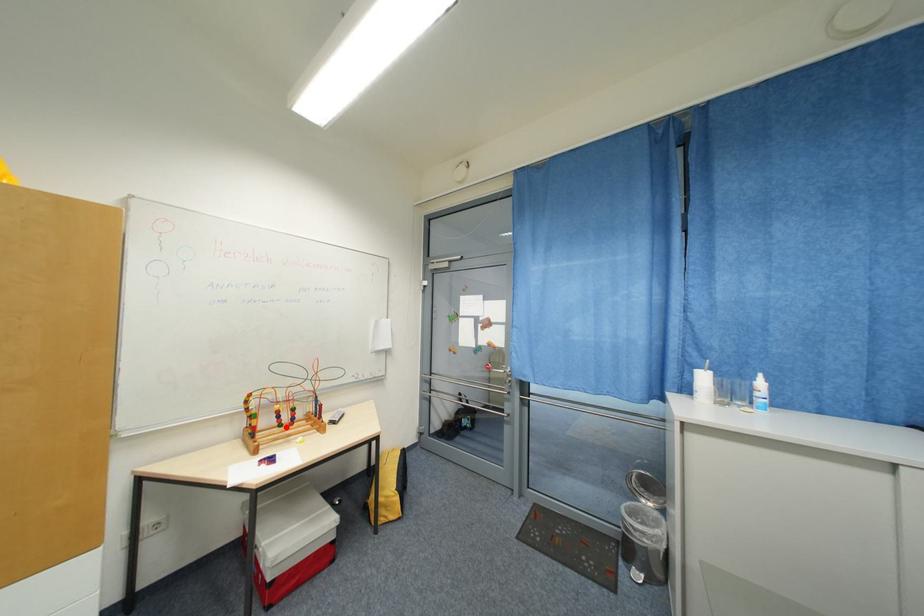
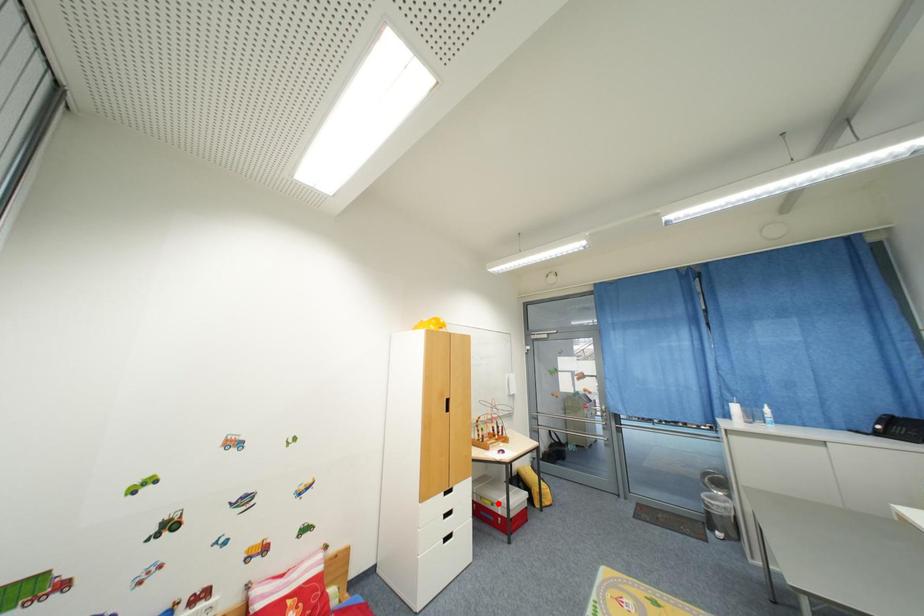
I am providing you with two images of the same scene from different viewpoints. A red point is marked on the first image and another point is marked on the second image. Do the highlighted points in image1 and image2 indicate the same real-world spot?

No